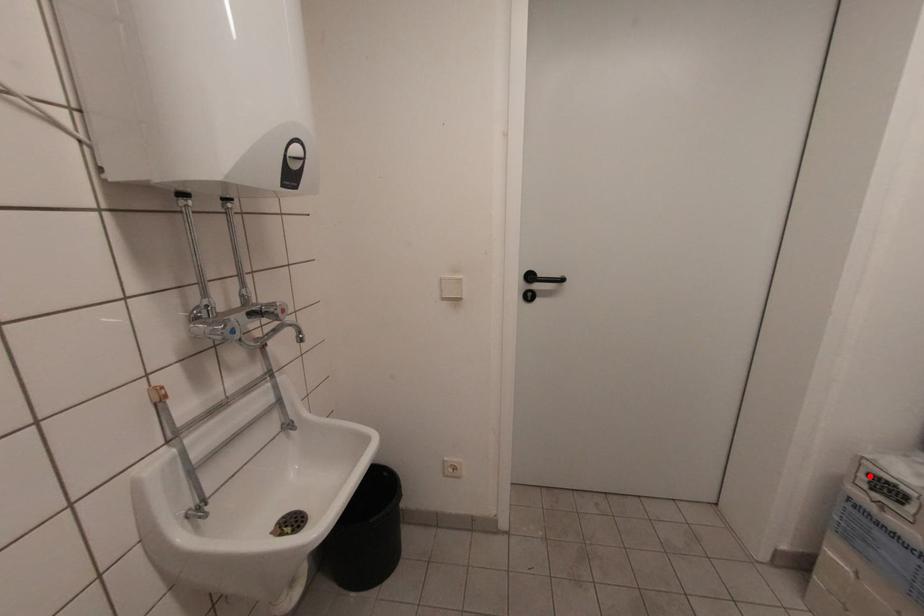
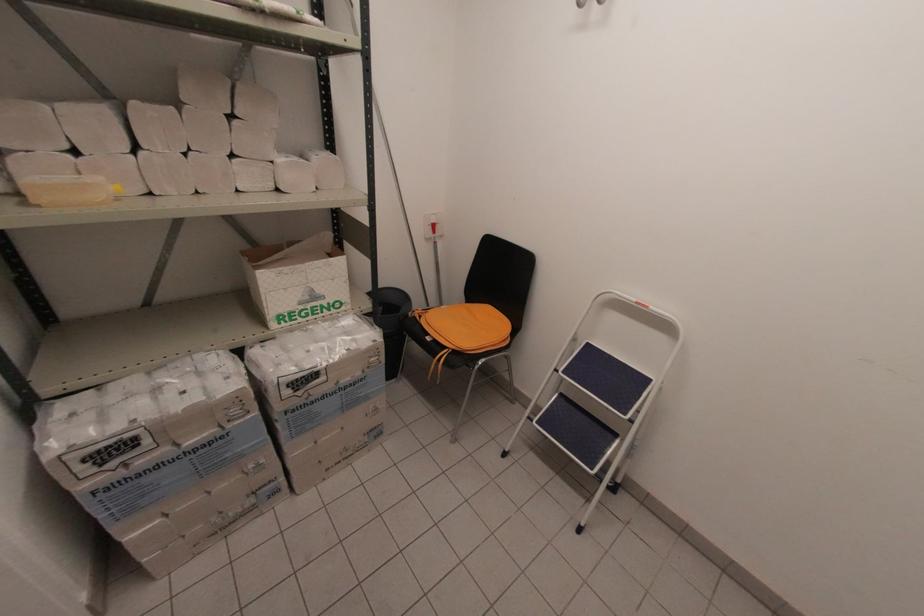
Question: I am providing you with two images of the same scene from different viewpoints. Given a red point in image1, look at the same physical point in image2. Is it:

Choices:
 (A) Closer to the viewpoint
 (B) Farther from the viewpoint

Answer: (A)